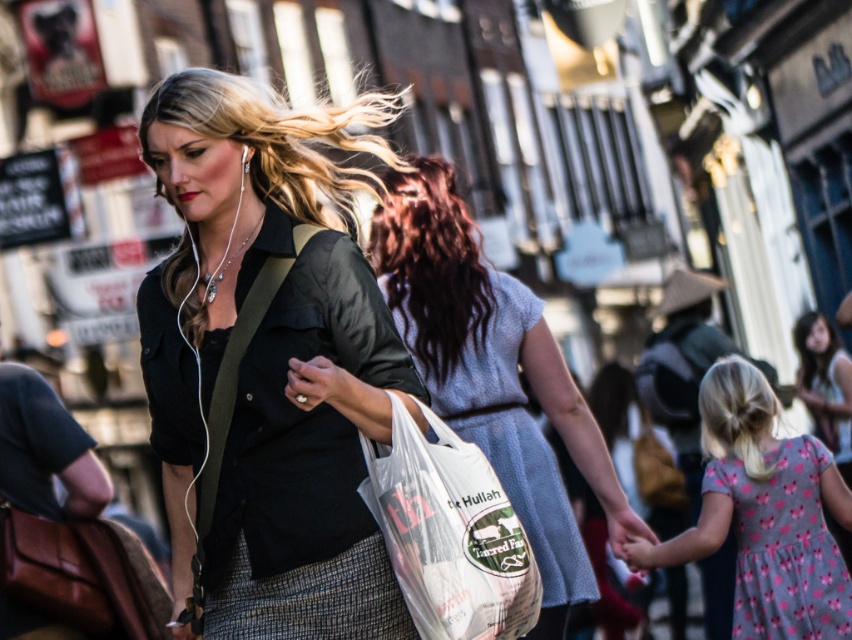
Question: Can you confirm if matte black shirt at center is positioned below light blue fabric dress at center?

Choices:
 (A) no
 (B) yes

Answer: (A)

Question: Is matte black shirt at center to the left of light blue fabric dress at center from the viewer's perspective?

Choices:
 (A) yes
 (B) no

Answer: (A)

Question: Which point is farther from the camera taking this photo?

Choices:
 (A) (505, 273)
 (B) (361, 145)
 (C) (799, 524)

Answer: (A)

Question: Is pink fabric dress at lower right to the left of white plastic grocery bag at center from the viewer's perspective?

Choices:
 (A) no
 (B) yes

Answer: (A)

Question: Which of the following is the farthest from the observer?

Choices:
 (A) (849, 381)
 (B) (484, 564)
 (C) (413, 173)

Answer: (A)

Question: Which point is farther to the camera?

Choices:
 (A) matte black shirt at center
 (B) light pink fabric dress at lower right
 (C) pink floral fabric dress at lower right

Answer: (B)